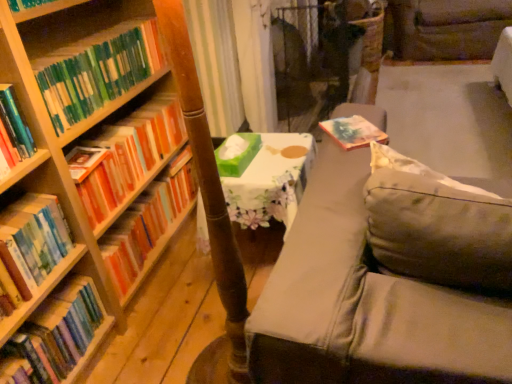
Question: Does hardcover books at left, the fourth book when ordered from bottom to top, turn towards green matte bookshelf at left, marked as the fifth book in a bottom-to-top arrangement?

Choices:
 (A) yes
 (B) no

Answer: (B)

Question: Is hardcover books at left, which appears as the second book when viewed from the top, outside green matte bookshelf at left, marked as the first book in a top-to-bottom arrangement?

Choices:
 (A) no
 (B) yes

Answer: (B)

Question: Does hardcover books at left, which appears as the second book when viewed from the top, touch green matte bookshelf at left, marked as the first book in a top-to-bottom arrangement?

Choices:
 (A) no
 (B) yes

Answer: (A)

Question: Is hardcover books at left, the fourth book when ordered from bottom to top, positioned with its back to green matte bookshelf at left, marked as the fifth book in a bottom-to-top arrangement?

Choices:
 (A) yes
 (B) no

Answer: (B)

Question: Can you confirm if hardcover books at left, the fourth book when ordered from bottom to top, is bigger than green matte bookshelf at left, marked as the first book in a top-to-bottom arrangement?

Choices:
 (A) no
 (B) yes

Answer: (B)

Question: Considering the positions of hardcover books at left, the 1th book when ordered from bottom to top, and orange matte bookshelf at left, which appears as the third book when ordered from the bottom, in the image, is hardcover books at left, the 1th book when ordered from bottom to top, taller or shorter than orange matte bookshelf at left, which appears as the third book when ordered from the bottom,?

Choices:
 (A) tall
 (B) short

Answer: (B)

Question: Relative to orange matte bookshelf at left, the 3th book viewed from the top, is hardcover books at left, the 1th book when ordered from bottom to top, in front or behind?

Choices:
 (A) behind
 (B) front

Answer: (B)

Question: Considering the positions of point (77, 281) and point (159, 223), is point (77, 281) closer or farther from the camera than point (159, 223)?

Choices:
 (A) farther
 (B) closer

Answer: (B)

Question: From a real-world perspective, is hardcover books at left, arranged as the fifth book when viewed from the top, physically located above or below orange matte bookshelf at left, which appears as the third book when ordered from the bottom?

Choices:
 (A) above
 (B) below

Answer: (B)

Question: Is green matte bookshelf at left, marked as the fifth book in a bottom-to-top arrangement, wider or thinner than orange matte bookshelf at left, the 3th book viewed from the top?

Choices:
 (A) wide
 (B) thin

Answer: (A)

Question: Is green matte bookshelf at left, marked as the fifth book in a bottom-to-top arrangement, in front of or behind orange matte bookshelf at left, the 3th book viewed from the top, in the image?

Choices:
 (A) behind
 (B) front

Answer: (B)

Question: Is green matte bookshelf at left, marked as the first book in a top-to-bottom arrangement, inside the boundaries of orange matte bookshelf at left, which appears as the third book when ordered from the bottom, or outside?

Choices:
 (A) inside
 (B) outside

Answer: (B)

Question: In the image, is green matte bookshelf at left, marked as the fifth book in a bottom-to-top arrangement, on the left side or the right side of orange matte bookshelf at left, which appears as the third book when ordered from the bottom?

Choices:
 (A) left
 (B) right

Answer: (A)

Question: Considering the positions of gray fabric swivel chair at upper right and green matte tissue box at center in the image, is gray fabric swivel chair at upper right bigger or smaller than green matte tissue box at center?

Choices:
 (A) small
 (B) big

Answer: (B)

Question: In terms of width, does gray fabric swivel chair at upper right look wider or thinner when compared to green matte tissue box at center?

Choices:
 (A) wide
 (B) thin

Answer: (A)